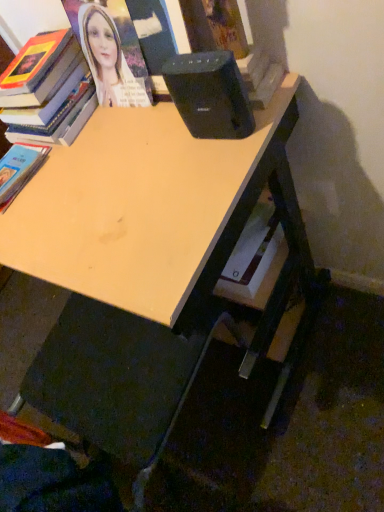
Question: In the image, is hardcover book at upper left, which is the 2th book in bottom-to-top order, on the left side or the right side of black plastic speaker at upper center?

Choices:
 (A) left
 (B) right

Answer: (A)

Question: Considering the positions of hardcover book at upper left, which is the 2th book in bottom-to-top order, and black plastic speaker at upper center in the image, is hardcover book at upper left, which is the 2th book in bottom-to-top order, taller or shorter than black plastic speaker at upper center?

Choices:
 (A) short
 (B) tall

Answer: (B)

Question: Based on their relative distances, which object is farther from the black plastic speaker at upper center?

Choices:
 (A) hardcover book at lower left, marked as the second book in a top-to-bottom arrangement
 (B) hardcover book at upper left, which is the 2th book in bottom-to-top order
 (C) light wood desk at center

Answer: (A)

Question: Which is farther from the hardcover book at lower left, marked as the second book in a top-to-bottom arrangement?

Choices:
 (A) hardcover book at upper left, which is the 2th book in bottom-to-top order
 (B) light wood desk at center
 (C) black plastic speaker at upper center

Answer: (C)